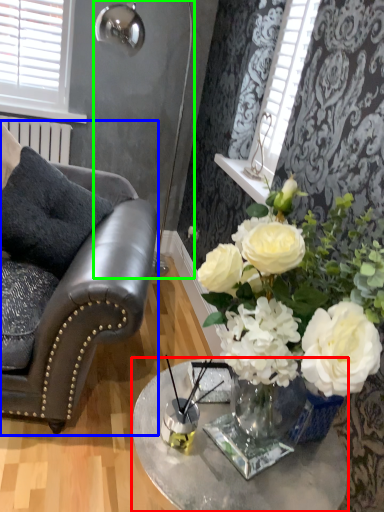
Question: Considering the real-world distances, which object is closest to table (highlighted by a red box)? chair (highlighted by a blue box) or lamp (highlighted by a green box).

Choices:
 (A) chair
 (B) lamp

Answer: (A)